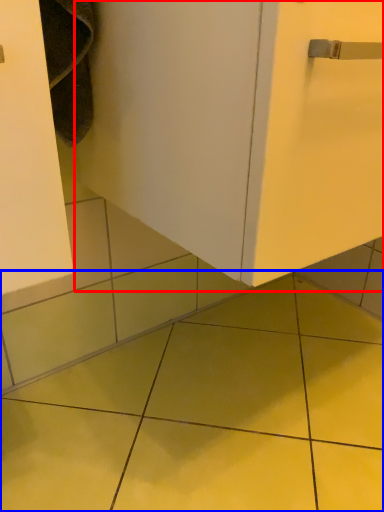
Question: Which object is closer to the camera taking this photo, door (highlighted by a red box) or ceramic tile (highlighted by a blue box)?

Choices:
 (A) door
 (B) ceramic tile

Answer: (A)